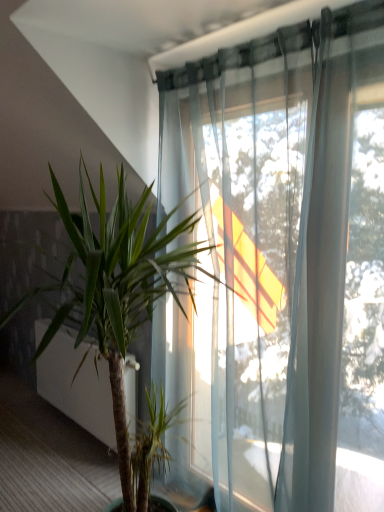
Question: Would you say green leafy plant at center is to the left or to the right of green leafy plant at lower left in the picture?

Choices:
 (A) left
 (B) right

Answer: (B)

Question: Considering the positions of point (137, 258) and point (92, 398), is point (137, 258) closer or farther from the camera than point (92, 398)?

Choices:
 (A) closer
 (B) farther

Answer: (A)

Question: From their relative heights in the image, would you say green leafy plant at center is taller or shorter than green leafy plant at lower left?

Choices:
 (A) short
 (B) tall

Answer: (B)

Question: From a real-world perspective, is green leafy plant at lower left above or below green leafy plant at center?

Choices:
 (A) above
 (B) below

Answer: (B)

Question: In terms of size, does green leafy plant at lower left appear bigger or smaller than green leafy plant at center?

Choices:
 (A) small
 (B) big

Answer: (A)

Question: In the image, is green leafy plant at lower left on the left side or the right side of green leafy plant at center?

Choices:
 (A) left
 (B) right

Answer: (A)

Question: Which is correct: green leafy plant at lower left is inside green leafy plant at center, or outside of it?

Choices:
 (A) inside
 (B) outside

Answer: (B)